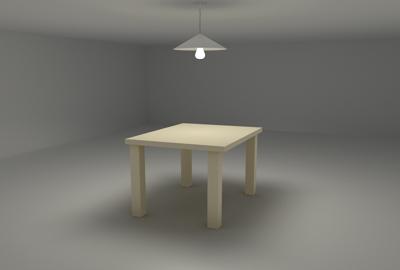
Identify the location of lamp cord. (199, 14).